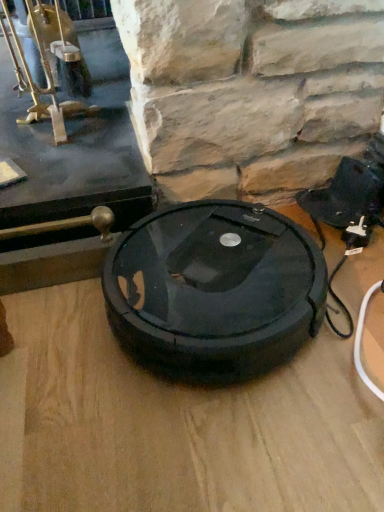
The height and width of the screenshot is (512, 384). I want to click on free spot in front of black rubber robot vacuum cleaner at center, so click(214, 442).